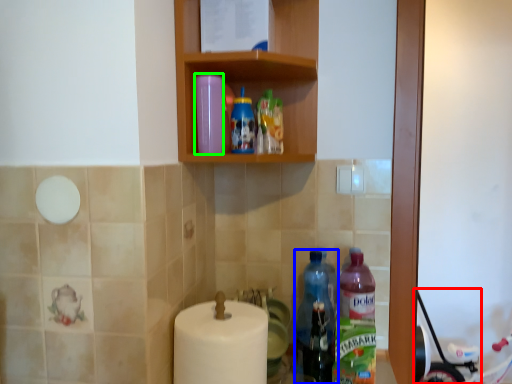
Question: Which is farther away from baby carriage (highlighted by a red box)? bottle (highlighted by a blue box) or bottle (highlighted by a green box)?

Choices:
 (A) bottle
 (B) bottle

Answer: (B)